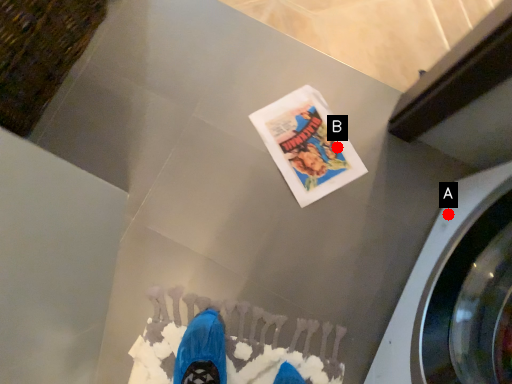
Question: Two points are circled on the image, labeled by A and B beside each circle. Which point is further to the camera?

Choices:
 (A) A is further
 (B) B is further

Answer: (B)